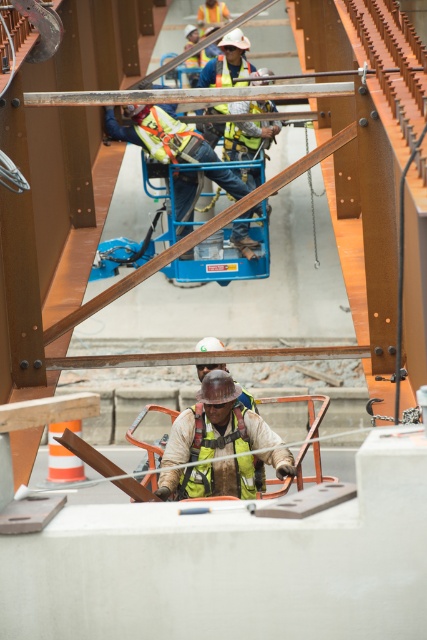
You are a safety inspector reviewing the construction site from above. You notice a point at coordinates [216,424]. What object does this point correspond to?

The point at coordinates [216,424] corresponds to the reflective yellow safety vest at center.